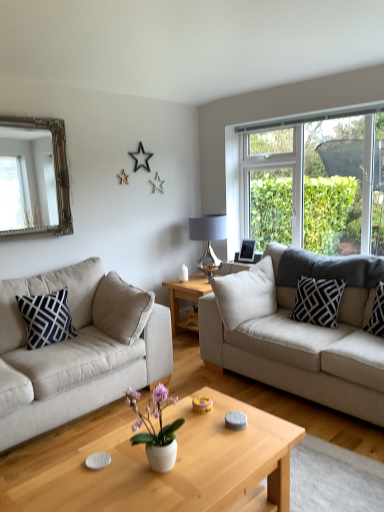
Identify the location of vacant space that is to the left of white ceramic pot at center. The height and width of the screenshot is (512, 384). (107, 482).